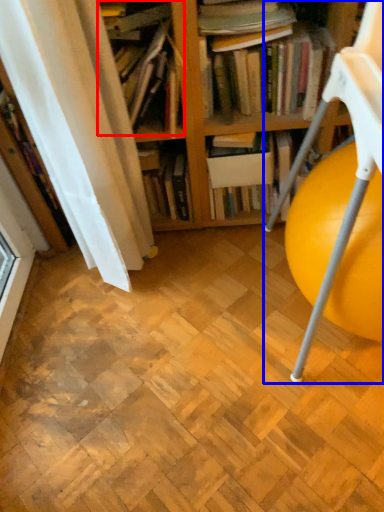
Question: Which point is further to the camera, book (highlighted by a red box) or rocking chair (highlighted by a blue box)?

Choices:
 (A) book
 (B) rocking chair

Answer: (A)